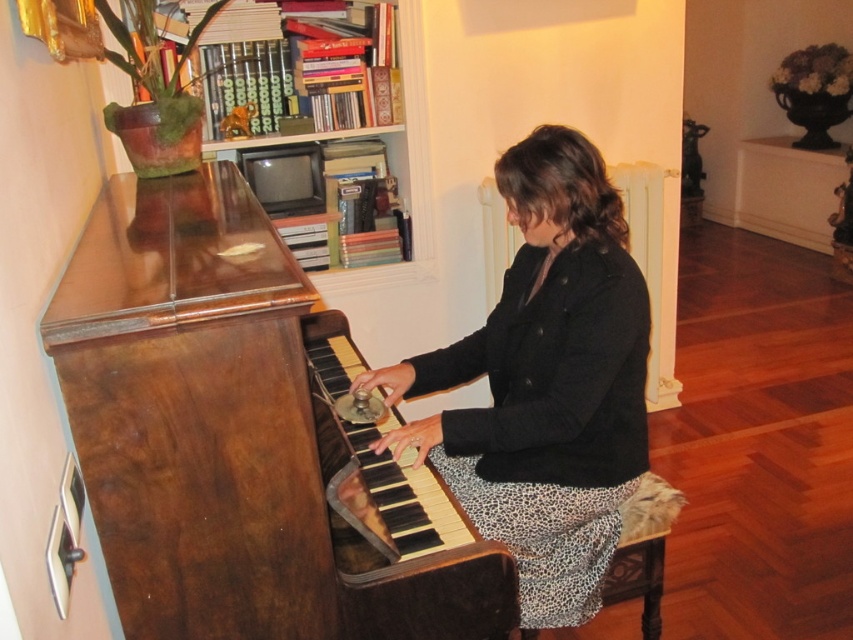
Question: Does black textured coat at center have a greater width compared to leopard print fabric at lower center?

Choices:
 (A) no
 (B) yes

Answer: (B)

Question: Is shiny brown piano at center to the right of wooden bookshelf at upper center from the viewer's perspective?

Choices:
 (A) yes
 (B) no

Answer: (A)

Question: Which of the following is the closest to the observer?

Choices:
 (A) shiny brown piano at center
 (B) wooden bookshelf at upper center

Answer: (A)

Question: Which object is the closest to the shiny brown piano at center?

Choices:
 (A) wooden bookshelf at upper center
 (B) black textured coat at center
 (C) leopard print fabric at lower center

Answer: (B)

Question: Can you confirm if black textured coat at center is smaller than leopard print fabric at lower center?

Choices:
 (A) yes
 (B) no

Answer: (B)

Question: Which of the following is the closest to the observer?

Choices:
 (A) (99, 396)
 (B) (670, 525)

Answer: (A)